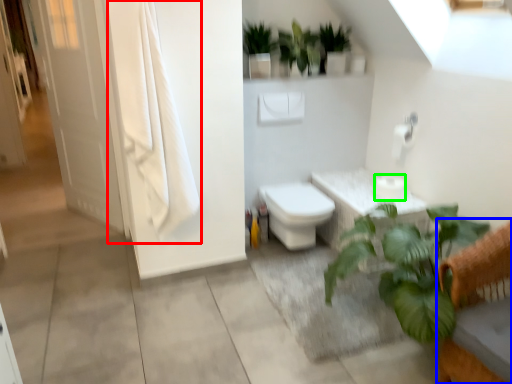
Question: Considering the real-world distances, which object is farthest from curtain (highlighted by a red box)? furniture (highlighted by a blue box) or toilet paper (highlighted by a green box)?

Choices:
 (A) furniture
 (B) toilet paper

Answer: (A)